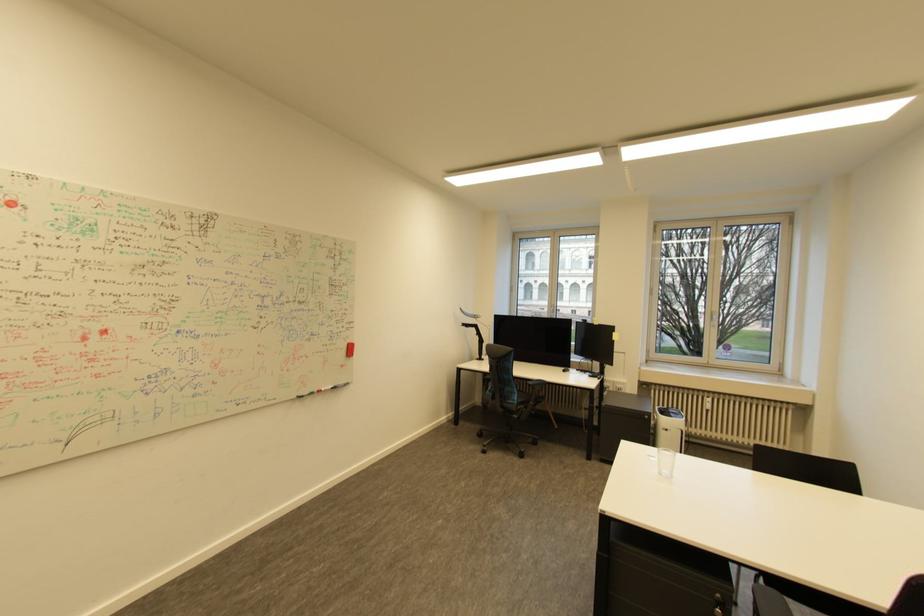
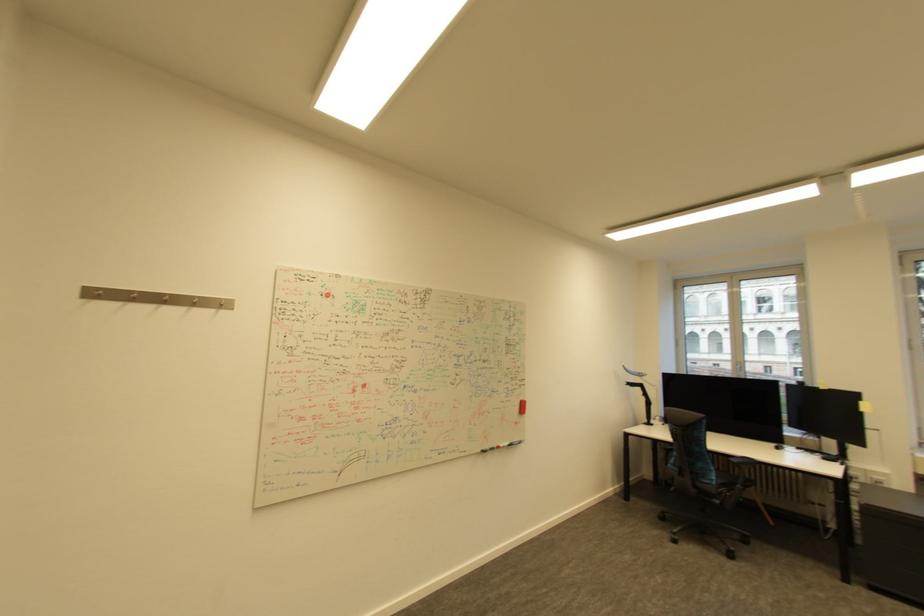
Looking at this image, what movement of the cameraman would produce the second image?

The cameraman moved toward left, backward.